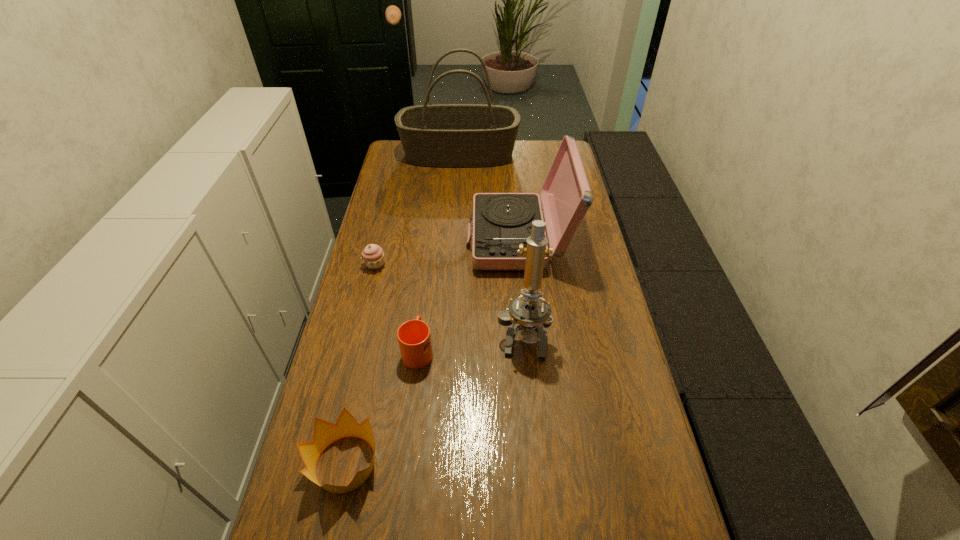
Image resolution: width=960 pixels, height=540 pixels. I want to click on the farthest object, so click(441, 135).

Locate an element on the screen. The width and height of the screenshot is (960, 540). microscope is located at coordinates (528, 313).

At what (x,y) coordinates should I click in order to perform the action: click on record player. Please return your answer as a coordinate pair (x, y). The image size is (960, 540). Looking at the image, I should click on (501, 221).

Where is `mug`? The image size is (960, 540). mug is located at coordinates (414, 337).

Locate an element on the screen. This screenshot has height=540, width=960. crown is located at coordinates [x=325, y=433].

Locate an element on the screen. This screenshot has height=540, width=960. cupcake is located at coordinates (373, 256).

Where is `free space located 0.180m on the front of the farthest object`? The width and height of the screenshot is (960, 540). free space located 0.180m on the front of the farthest object is located at coordinates (456, 194).

The width and height of the screenshot is (960, 540). What are the coordinates of `vacant area located 0.080m on the right of the microscope` in the screenshot? It's located at point(577,335).

Find the location of `vacant space located 0.220m with the lid open on the fourth shortest object`. vacant space located 0.220m with the lid open on the fourth shortest object is located at coordinates (404, 239).

This screenshot has height=540, width=960. Find the location of `free spot located with the lid open on the fourth shortest object`. free spot located with the lid open on the fourth shortest object is located at coordinates (371, 239).